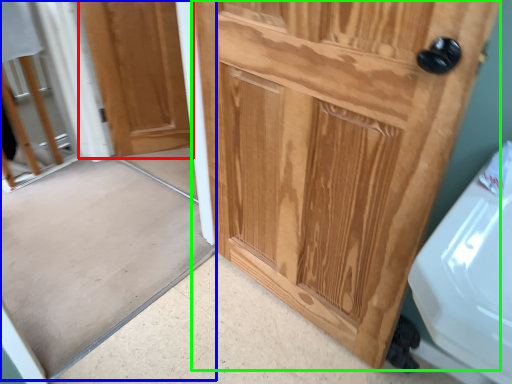
Question: Based on their relative distances, which object is farther from door (highlighted by a red box)? Choose from screen door (highlighted by a blue box) and door (highlighted by a green box).

Choices:
 (A) screen door
 (B) door

Answer: (B)